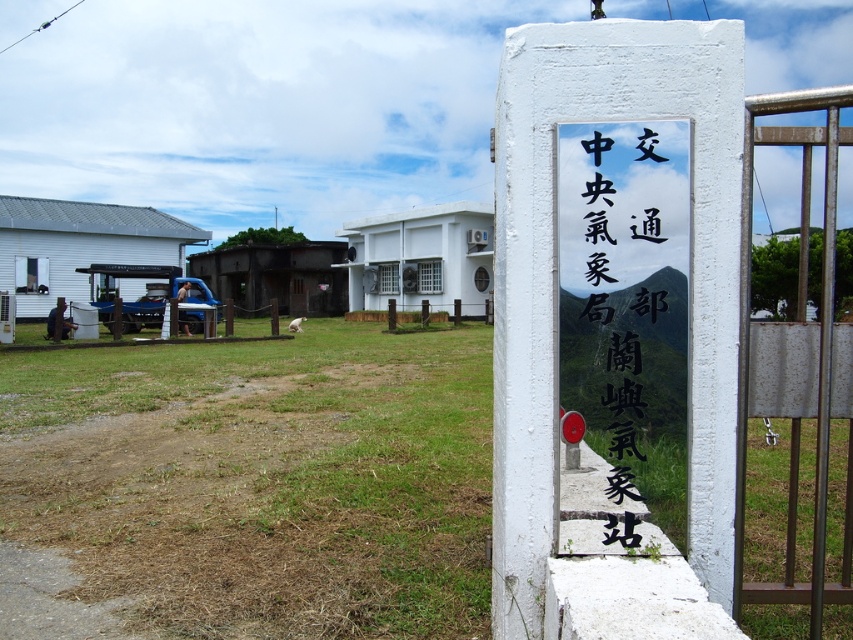
Which is above, white stone sign at center or brown metal gate at right?

Positioned higher is brown metal gate at right.

Can you confirm if white stone sign at center is positioned to the left of brown metal gate at right?

Yes, white stone sign at center is to the left of brown metal gate at right.

This screenshot has width=853, height=640. What do you see at coordinates (627, 308) in the screenshot? I see `white stone sign at center` at bounding box center [627, 308].

Find the location of `white stone sign at center`. white stone sign at center is located at coordinates (627, 308).